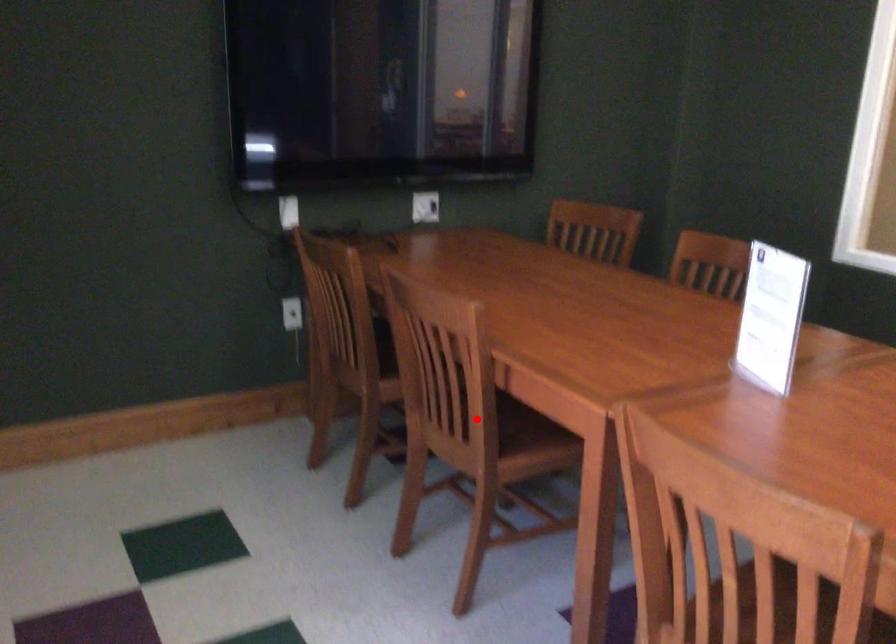
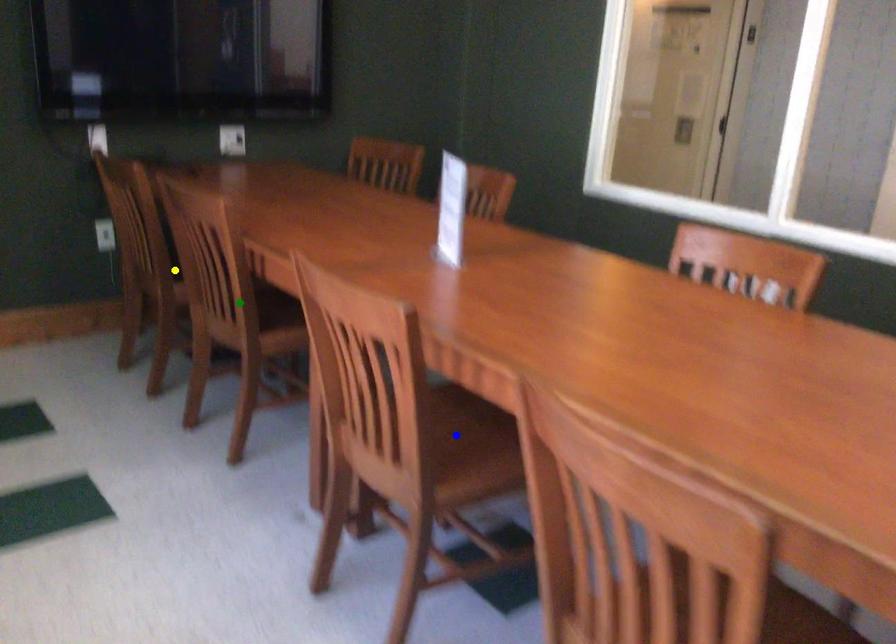
Question: I am providing you with two images of the same scene from different viewpoints. A red point is marked on the first image. You are given multiple points on the second image. Which spot in image 2 lines up with the point in image 1?

Choices:
 (A) yellow point
 (B) blue point
 (C) green point

Answer: (C)